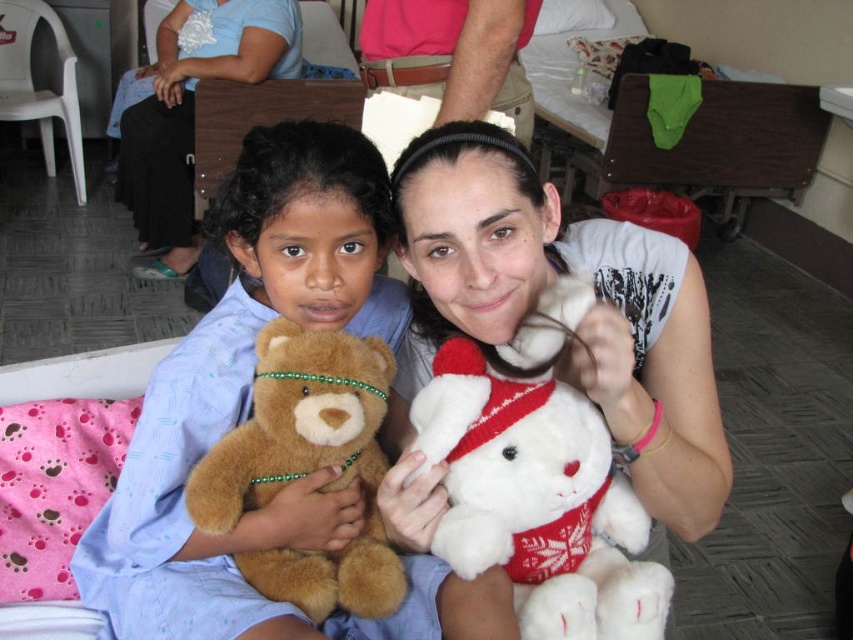
Does soft brown teddy bear at center have a smaller size compared to soft brown teddy bear at left?

No, soft brown teddy bear at center is not smaller than soft brown teddy bear at left.

Who is positioned more to the left, soft brown teddy bear at center or soft brown teddy bear at left?

soft brown teddy bear at left is more to the left.

Does point (141, 636) lie behind point (291, 410)?

Yes, it is behind point (291, 410).

Identify the location of soft brown teddy bear at center. (250, 401).

Is point (535, 236) more distant than point (547, 420)?

Yes.

Who is more forward, (x=465, y=266) or (x=550, y=525)?

Point (x=465, y=266)

Between point (508, 308) and point (471, 576), which one is positioned behind?

Point (508, 308)

Where is `white plush bear at center`? Image resolution: width=853 pixels, height=640 pixels. white plush bear at center is located at coordinates (579, 323).

Does soft brown teddy bear at center appear on the left side of white plush bear at center?

Correct, you'll find soft brown teddy bear at center to the left of white plush bear at center.

Which of these two, soft brown teddy bear at center or white plush bear at center, stands shorter?

With less height is white plush bear at center.

Who is more forward, [184,588] or [416,154]?

Point [416,154]

Where is `soft brown teddy bear at center`? soft brown teddy bear at center is located at coordinates (x=250, y=401).